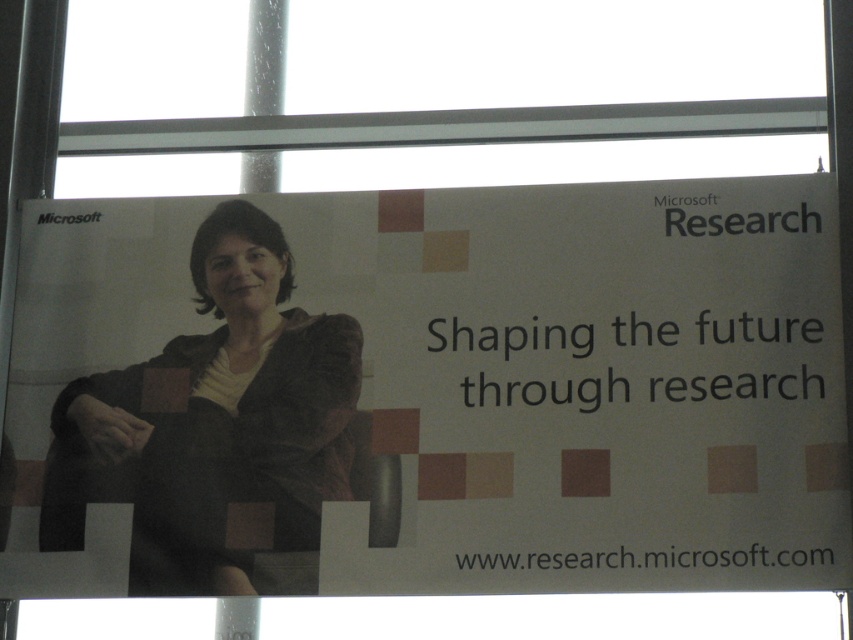
You are designing a layout for a promotional banner and need to ensure that the white paper at center and the matte brown jacket at center are both visible. Given their sizes, which object should be placed in a position where it won

The white paper at center has a larger size compared to the matte brown jacket at center, so it should be placed in a position where its larger size can be accommodated without overcrowding the banner.

You are designing a layout for a promotional banner and need to ensure that the white paper at center and the matte brown jacket at center are positioned correctly. Based on the banner design described, which object should be placed first to maintain the intended visual hierarchy?

The white paper at center should be placed first because it is wider than the matte brown jacket at center, ensuring it occupies the central focal point effectively.